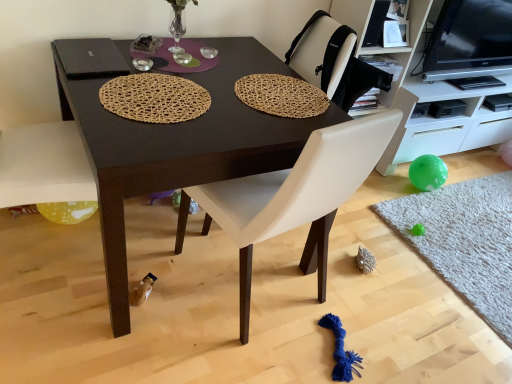
You are a GUI agent. You are given a task and a screenshot of the screen. Output one action in this format:
    pyautogui.click(x=<x>, y=<y>)
    Task: Click on the free space that is to the left of woven natural mat at upper center, the 1th mat when ordered from top to bottom
    
    Given the screenshot: What is the action you would take?
    pyautogui.click(x=195, y=84)